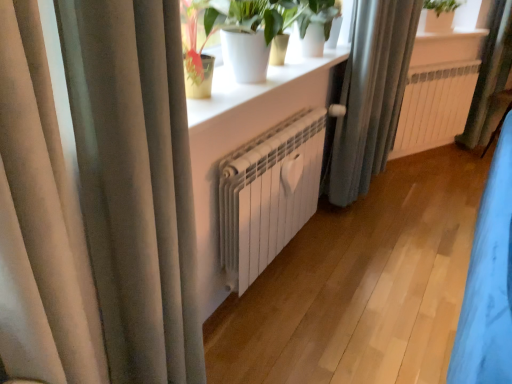
Describe the element at coordinates (434, 106) in the screenshot. I see `white matte radiator at center, positioned as the 1th radiator in top-to-bottom order` at that location.

The height and width of the screenshot is (384, 512). Identify the location of satin beige curtain at left, the third curtain when ordered from back to front. (97, 200).

This screenshot has height=384, width=512. Identify the location of gray fabric curtain at center, which is the second curtain in back-to-front order. (371, 94).

Measure the distance between white matte pot at upper center and camera.

The depth of white matte pot at upper center is 3.94 feet.

Find the location of a particular element. Image resolution: width=512 pixels, height=384 pixels. white matte radiator at center, the 2th radiator from the left is located at coordinates (434, 106).

Looking at the image, does white matte radiator at center, which appears as the first radiator when viewed from the right, seem bigger or smaller compared to white matte radiator at center, the second radiator positioned from the back?

Considering their sizes, white matte radiator at center, which appears as the first radiator when viewed from the right, takes up less space than white matte radiator at center, the second radiator positioned from the back.

Is white matte radiator at center, which appears as the first radiator when viewed from the right, placed right next to white matte radiator at center, the 2th radiator positioned from the right?

No, white matte radiator at center, which appears as the first radiator when viewed from the right, is not next to white matte radiator at center, the 2th radiator positioned from the right.

Which object is closer to the camera, white matte radiator at center, which is counted as the 2th radiator, starting from the bottom, or white matte radiator at center, the 1th radiator from the front?

white matte radiator at center, the 1th radiator from the front, is more forward.

How many degrees apart are the facing directions of white matte radiator at center, the 1th radiator from the front, and satin beige curtain at left, the third curtain when ordered from back to front?

There is a 2.31-degree angle between the facing directions of white matte radiator at center, the 1th radiator from the front, and satin beige curtain at left, the third curtain when ordered from back to front.

Could you tell me if white matte radiator at center, the 2th radiator positioned from the right, is turned towards satin beige curtain at left, the first curtain in the left-to-right sequence?

No, white matte radiator at center, the 2th radiator positioned from the right, is not turned towards satin beige curtain at left, the first curtain in the left-to-right sequence.

This screenshot has height=384, width=512. Find the location of `curtain on the left of white matte radiator at center, the 2th radiator positioned from the right`. curtain on the left of white matte radiator at center, the 2th radiator positioned from the right is located at coordinates (97, 200).

Is the position of green fabric curtain at right, the 3th curtain in the front-to-back sequence, less distant than that of gray fabric curtain at center, which is counted as the second curtain, starting from the right?

No, it is not.

Is green fabric curtain at right, the third curtain viewed from the left, not close to gray fabric curtain at center, which is counted as the second curtain, starting from the right?

Yes, green fabric curtain at right, the third curtain viewed from the left, and gray fabric curtain at center, which is counted as the second curtain, starting from the right, are located far from each other.

Considering the relative sizes of green fabric curtain at right, the 3th curtain in the front-to-back sequence, and gray fabric curtain at center, which ranks as the second curtain in front-to-back order, in the image provided, is green fabric curtain at right, the 3th curtain in the front-to-back sequence, wider than gray fabric curtain at center, which ranks as the second curtain in front-to-back order,?

Incorrect, the width of green fabric curtain at right, the 3th curtain in the front-to-back sequence, does not surpass that of gray fabric curtain at center, which ranks as the second curtain in front-to-back order.

What's the angular difference between green fabric curtain at right, the 3th curtain in the front-to-back sequence, and gray fabric curtain at center, which ranks as the second curtain in front-to-back order,'s facing directions?

The angle between the facing direction of green fabric curtain at right, the 3th curtain in the front-to-back sequence, and the facing direction of gray fabric curtain at center, which ranks as the second curtain in front-to-back order, is 22.1 degrees.

Considering the positions of objects white matte radiator at center, the 1th radiator from the front, and gray fabric curtain at center, the second curtain viewed from the left, in the image provided, who is more to the left, white matte radiator at center, the 1th radiator from the front, or gray fabric curtain at center, the second curtain viewed from the left,?

white matte radiator at center, the 1th radiator from the front, is more to the left.

Between white matte radiator at center, marked as the first radiator in a left-to-right arrangement, and gray fabric curtain at center, which is the second curtain in back-to-front order, which one is positioned behind?

Positioned behind is gray fabric curtain at center, which is the second curtain in back-to-front order.

From a real-world perspective, does white matte radiator at center, which appears as the 2th radiator when viewed from the top, sit lower than gray fabric curtain at center, the second curtain viewed from the left?

Yes, from a real-world perspective, white matte radiator at center, which appears as the 2th radiator when viewed from the top, is beneath gray fabric curtain at center, the second curtain viewed from the left.

In the scene shown: Can you tell me how much white matte radiator at center, which appears as the 2th radiator when viewed from the top, and gray fabric curtain at center, the second curtain viewed from the left, differ in facing direction?

The angular difference between white matte radiator at center, which appears as the 2th radiator when viewed from the top, and gray fabric curtain at center, the second curtain viewed from the left, is 0.24 degrees.

From the image's perspective, between satin beige curtain at left, the first curtain from the front, and white matte radiator at center, arranged as the 1th radiator when viewed from the back, which one is located above?

white matte radiator at center, arranged as the 1th radiator when viewed from the back, appears higher in the image.

Which point is more forward, (x=8, y=123) or (x=447, y=120)?

Positioned in front is point (x=8, y=123).

Identify the location of the 3rd curtain above the white matte radiator at center, which appears as the first radiator when viewed from the right (from a real-world perspective). This screenshot has width=512, height=384. (97, 200).

Who is bigger, satin beige curtain at left, the third curtain when ordered from back to front, or white matte radiator at center, marked as the 2th radiator in a front-to-back arrangement?

satin beige curtain at left, the third curtain when ordered from back to front.

Which object is wider, white matte radiator at center, positioned as the 1th radiator in top-to-bottom order, or gray fabric curtain at center, which is the second curtain in back-to-front order?

gray fabric curtain at center, which is the second curtain in back-to-front order, is wider.

Is white matte radiator at center, which is counted as the 2th radiator, starting from the bottom, facing towards gray fabric curtain at center, which ranks as the second curtain in front-to-back order?

No, white matte radiator at center, which is counted as the 2th radiator, starting from the bottom, is not oriented towards gray fabric curtain at center, which ranks as the second curtain in front-to-back order.

From a real-world perspective, who is located lower, white matte radiator at center, marked as the 2th radiator in a front-to-back arrangement, or gray fabric curtain at center, which is the second curtain in back-to-front order?

white matte radiator at center, marked as the 2th radiator in a front-to-back arrangement.

Relative to gray fabric curtain at center, which is the second curtain in back-to-front order, is white matte pot at upper center in front or behind?

Visually, white matte pot at upper center is located in front of gray fabric curtain at center, which is the second curtain in back-to-front order.

Between white matte pot at upper center and gray fabric curtain at center, which ranks as the second curtain in front-to-back order, which one has smaller width?

gray fabric curtain at center, which ranks as the second curtain in front-to-back order, is thinner.

How distant is white matte pot at upper center from gray fabric curtain at center, the second curtain viewed from the left?

white matte pot at upper center is 26.88 inches from gray fabric curtain at center, the second curtain viewed from the left.

Locate an element on the screen. radiator in front of the white matte radiator at center, which appears as the first radiator when viewed from the right is located at coordinates (268, 194).

From a real-world perspective, starting from the satin beige curtain at left, the first curtain from the front, which radiator is the 2nd one below it? Please provide its 2D coordinates.

[(268, 194)]

Based on their spatial positions, is white matte radiator at center, marked as the 2th radiator in a front-to-back arrangement, or satin beige curtain at left, the first curtain from the front, closer to white matte radiator at center, marked as the first radiator in a left-to-right arrangement?

satin beige curtain at left, the first curtain from the front, is positioned closer to the anchor white matte radiator at center, marked as the first radiator in a left-to-right arrangement.

Estimate the real-world distances between objects in this image. Which object is further from gray fabric curtain at center, which ranks as the second curtain in front-to-back order, white matte radiator at center, the 2th radiator positioned from the right, or white matte pot at upper center?

The object further to gray fabric curtain at center, which ranks as the second curtain in front-to-back order, is white matte pot at upper center.

Considering their positions, is gray fabric curtain at center, which ranks as the second curtain in front-to-back order, positioned further to white matte radiator at center, arranged as the 1th radiator when viewed from the back, than satin beige curtain at left, the third curtain when ordered from back to front?

satin beige curtain at left, the third curtain when ordered from back to front, is further to white matte radiator at center, arranged as the 1th radiator when viewed from the back.

Estimate the real-world distances between objects in this image. Which object is closer to gray fabric curtain at center, which ranks as the second curtain in front-to-back order, white matte radiator at center, which is the 1th radiator from bottom to top, or green fabric curtain at right, placed as the 1th curtain when sorted from back to front?

white matte radiator at center, which is the 1th radiator from bottom to top, lies closer to gray fabric curtain at center, which ranks as the second curtain in front-to-back order, than the other object.

From the image, which object appears to be nearer to white matte pot at upper center, white matte radiator at center, which is counted as the 2th radiator, starting from the bottom, or green fabric curtain at right, the third curtain viewed from the left?

white matte radiator at center, which is counted as the 2th radiator, starting from the bottom, lies closer to white matte pot at upper center than the other object.

Looking at the image, which one is located further to gray fabric curtain at center, the second curtain viewed from the left, satin beige curtain at left, the third curtain when ordered from back to front, or white matte radiator at center, marked as the first radiator in a left-to-right arrangement?

Based on the image, satin beige curtain at left, the third curtain when ordered from back to front, appears to be further to gray fabric curtain at center, the second curtain viewed from the left.

Considering their positions, is white matte pot at upper center positioned further to white matte radiator at center, the 1th radiator from the front, than green fabric curtain at right, the third curtain viewed from the left?

green fabric curtain at right, the third curtain viewed from the left.

From the picture: Which object lies nearer to the anchor point satin beige curtain at left, the third curtain when ordered from back to front, white matte pot at upper center or green fabric curtain at right, the third curtain viewed from the left?

The object closer to satin beige curtain at left, the third curtain when ordered from back to front, is white matte pot at upper center.

The height and width of the screenshot is (384, 512). In order to click on houseplant between satin beige curtain at left, the first curtain from the front, and white matte radiator at center, the 2th radiator from the left, along the z-axis in this screenshot , I will do `click(253, 21)`.

The height and width of the screenshot is (384, 512). Identify the location of curtain between white matte radiator at center, the 2th radiator positioned from the right, and green fabric curtain at right, the 3th curtain in the front-to-back sequence, in the horizontal direction. (371, 94).

Where is `radiator between white matte pot at upper center and white matte radiator at center, arranged as the 1th radiator when viewed from the back, from front to back`? Image resolution: width=512 pixels, height=384 pixels. radiator between white matte pot at upper center and white matte radiator at center, arranged as the 1th radiator when viewed from the back, from front to back is located at coordinates (268, 194).

Where is `radiator between satin beige curtain at left, the first curtain from the front, and white matte radiator at center, arranged as the 1th radiator when viewed from the back, along the z-axis`? This screenshot has height=384, width=512. radiator between satin beige curtain at left, the first curtain from the front, and white matte radiator at center, arranged as the 1th radiator when viewed from the back, along the z-axis is located at coordinates (268, 194).